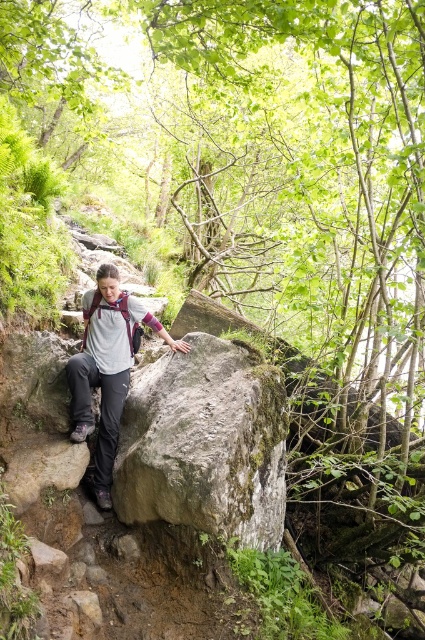
Question: Among these points, which one is farthest from the camera?

Choices:
 (A) (101, 326)
 (B) (240, 417)

Answer: (A)

Question: Does green mossy rock at center appear on the left side of matte gray shirt at center?

Choices:
 (A) yes
 (B) no

Answer: (B)

Question: Which point is farther from the camera taking this photo?

Choices:
 (A) (129, 326)
 (B) (175, 372)

Answer: (A)

Question: Does green mossy rock at center appear over matte gray shirt at center?

Choices:
 (A) no
 (B) yes

Answer: (A)

Question: Is green mossy rock at center positioned before matte gray shirt at center?

Choices:
 (A) no
 (B) yes

Answer: (B)